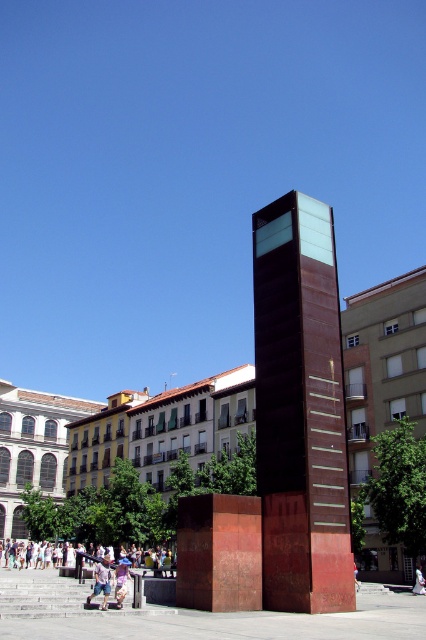
Question: Which object appears closest to the camera in this image?

Choices:
 (A) light blue denim jeans at lower center
 (B) light brown wooden bench at lower center

Answer: (A)

Question: Which object appears farthest from the camera in this image?

Choices:
 (A) rustic metal tower at center
 (B) light purple cotton dress at lower center

Answer: (B)

Question: Which point is farther to the camera?

Choices:
 (A) light blue denim jeans at lower center
 (B) light brown wooden bench at lower center
 (C) rustic metal tower at center

Answer: (B)

Question: Is light blue denim jeans at lower center wider than light brown wooden bench at lower center?

Choices:
 (A) yes
 (B) no

Answer: (B)

Question: From the image, what is the correct spatial relationship of rustic metal tower at center in relation to light purple cotton dress at lower center?

Choices:
 (A) right
 (B) left

Answer: (A)

Question: Is rustic metal tower at center below light brown wooden bench at lower center?

Choices:
 (A) no
 (B) yes

Answer: (A)